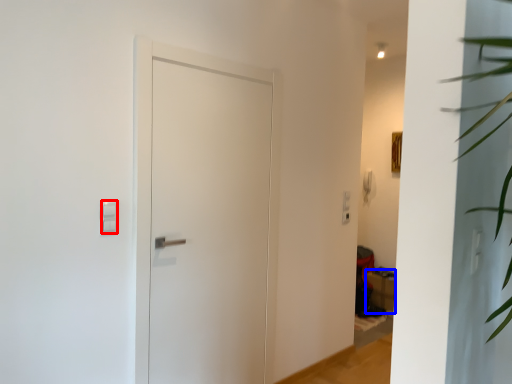
Question: Which point is further to the camera, light switch (highlighted by a red box) or furniture (highlighted by a blue box)?

Choices:
 (A) light switch
 (B) furniture

Answer: (B)